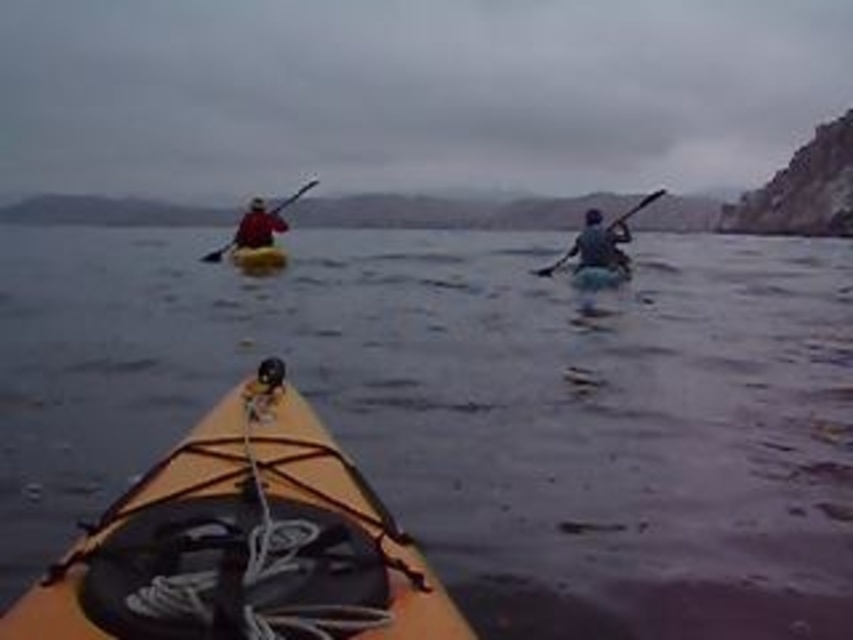
Question: Where is matte blue kayak at center located in relation to yellow matte kayak at center in the image?

Choices:
 (A) left
 (B) right

Answer: (B)

Question: Which point is farther to the camera?

Choices:
 (A) orange matte kayak at center
 (B) matte blue kayak at right
 (C) matte black paddle at upper left
 (D) matte blue kayak at center

Answer: (C)

Question: Which object is farther from the camera taking this photo?

Choices:
 (A) yellow matte kayak at center
 (B) smooth water at center
 (C) matte black paddle at upper left
 (D) matte red jacket at upper left

Answer: (C)

Question: Does yellow matte kayak at center have a larger size compared to smooth black paddle at right?

Choices:
 (A) no
 (B) yes

Answer: (A)

Question: From the image, what is the correct spatial relationship of orange matte kayak at center in relation to matte blue kayak at center?

Choices:
 (A) right
 (B) left

Answer: (B)

Question: Estimate the real-world distances between objects in this image. Which object is closer to the matte black paddle at upper left?

Choices:
 (A) matte blue kayak at center
 (B) smooth water at center
 (C) matte red jacket at upper left
 (D) yellow matte kayak at center

Answer: (D)